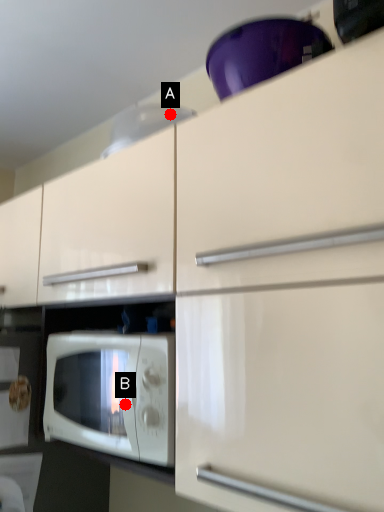
Question: Two points are circled on the image, labeled by A and B beside each circle. Among these points, which one is nearest to the camera?

Choices:
 (A) A is closer
 (B) B is closer

Answer: (B)